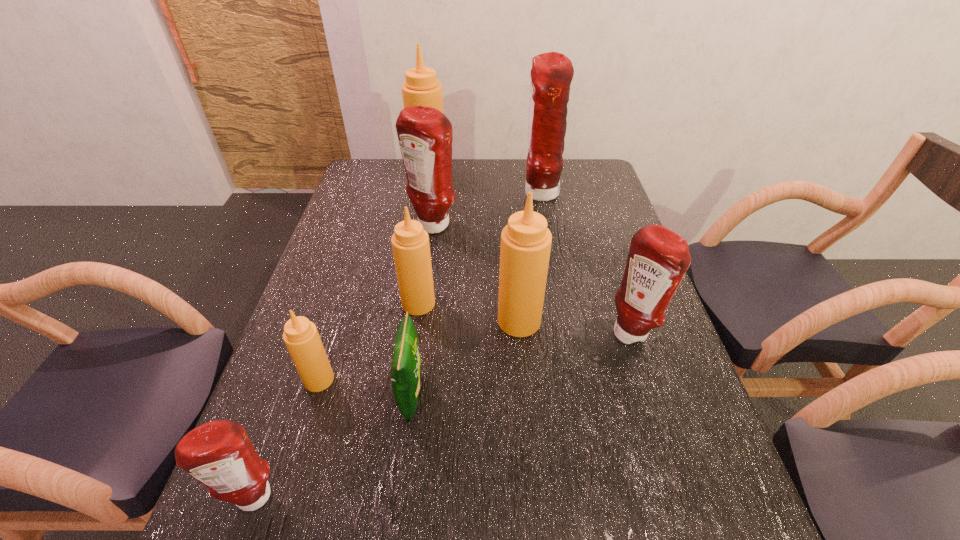
Where is `tan condiment that can be found as the closest to the third farthest object`? tan condiment that can be found as the closest to the third farthest object is located at coordinates (421, 88).

Identify which tan condiment is located as the fourth nearest to the farthest red condiment. Please provide its 2D coordinates. Your answer should be formatted as a tuple, i.e. [(x, y)], where the tuple contains the x and y coordinates of a point satisfying the conditions above.

[(301, 337)]

Locate an element on the screen. The height and width of the screenshot is (540, 960). the third closest red condiment to the third farthest condiment is located at coordinates (219, 454).

Identify the location of red condiment that can be found as the third closest to the rightmost tan condiment. The image size is (960, 540). (551, 75).

Locate an element on the screen. blank space that satisfies the following two spatial constraints: 1. on the back side of the third biggest tan condiment; 2. on the left side of the farthest red condiment is located at coordinates (434, 194).

The image size is (960, 540). In order to click on blank space that satisfies the following two spatial constraints: 1. on the front side of the second biggest tan condiment; 2. on the front-facing side of the green crisp (potato chip) in this screenshot , I will do `click(525, 395)`.